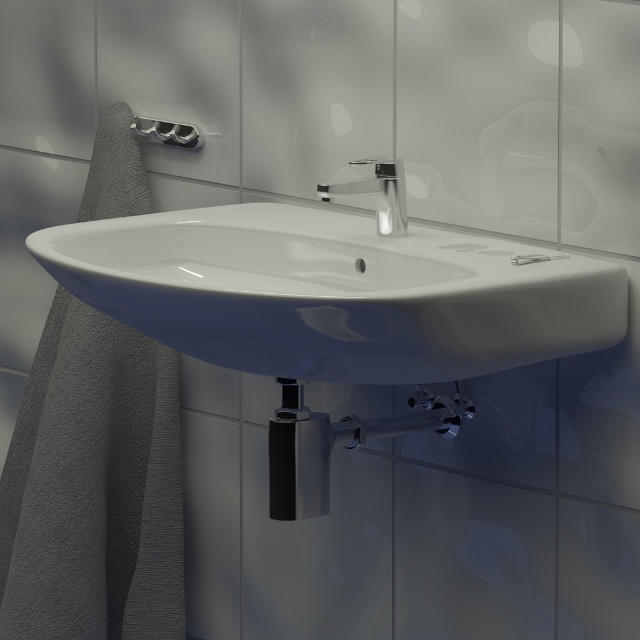
You are standing in front of the bathroom sink setup. There is a point at coordinates point (125, 244) that you need to reach. If you can extend your arm 1.5 meters, can you reach that point?

The point (125, 244) is 1.42 meters away from you, so yes, you can reach it since your arm can extend 1.5 meters.

You are designing a bathroom layout and need to ensure the white glossy sink at center and the brushed metal towel bar at upper left fit within a 1.2 meter wide space. Given their widths, will they both fit side by side?

The white glossy sink at center is wider than the brushed metal towel bar at upper left. However, without specific measurements, it is impossible to determine if their combined widths exceed 1.2 meters. Additional information about their individual dimensions is required to confirm.

You are a home decorator planning to install a new faucet and towel bar in a modern bathroom. You have two items to place in the bathroom. The polished chrome faucet at center needs to be larger than the brushed metal towel bar at upper left. Based on the image, does the current setup meet your requirement?

The polished chrome faucet at center is larger in size than the brushed metal towel bar at upper left, so the current setup meets the requirement.